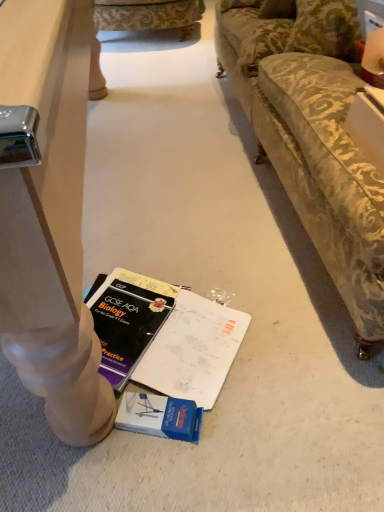
This screenshot has height=512, width=384. What do you see at coordinates (150, 16) in the screenshot?
I see `green floral fabric couch at upper center` at bounding box center [150, 16].

This screenshot has width=384, height=512. What are the coordinates of `green floral fabric couch at upper center` in the screenshot? It's located at (150, 16).

I want to click on velvet green pillow at upper right, so click(326, 29).

What do you see at coordinates (326, 29) in the screenshot? Image resolution: width=384 pixels, height=512 pixels. I see `velvet green pillow at upper right` at bounding box center [326, 29].

I want to click on green floral fabric couch at upper center, so click(150, 16).

Which object is positioned more to the left, green floral fabric couch at upper center or velvet green pillow at upper right?

Positioned to the left is green floral fabric couch at upper center.

Relative to velvet green pillow at upper right, is green floral fabric couch at upper center in front or behind?

green floral fabric couch at upper center is behind velvet green pillow at upper right.

Is point (108, 21) more distant than point (341, 37)?

Yes, it is behind point (341, 37).

From the image's perspective, between green floral fabric couch at upper center and velvet green pillow at upper right, who is located below?

velvet green pillow at upper right.

From a real-world perspective, is green floral fabric couch at upper center located higher than velvet green pillow at upper right?

No, from a real-world perspective, green floral fabric couch at upper center is not over velvet green pillow at upper right

Looking at their sizes, would you say green floral fabric couch at upper center is wider or thinner than velvet green pillow at upper right?

Clearly, green floral fabric couch at upper center has more width compared to velvet green pillow at upper right.

Considering the relative sizes of green floral fabric couch at upper center and velvet green pillow at upper right in the image provided, is green floral fabric couch at upper center shorter than velvet green pillow at upper right?

Incorrect, the height of green floral fabric couch at upper center does not fall short of that of velvet green pillow at upper right.

Who is bigger, green floral fabric couch at upper center or velvet green pillow at upper right?

With larger size is green floral fabric couch at upper center.

Looking at this image, is green floral fabric couch at upper center spatially inside velvet green pillow at upper right, or outside of it?

green floral fabric couch at upper center cannot be found inside velvet green pillow at upper right.

Is green floral fabric couch at upper center in contact with velvet green pillow at upper right?

No.

Is velvet green pillow at upper right at the back of green floral fabric couch at upper center?

No, green floral fabric couch at upper center is not facing the opposite direction of velvet green pillow at upper right.

Identify the location of studio couch behind the velvet green pillow at upper right. (150, 16).

Is velvet green pillow at upper right at the right side of green floral fabric couch at upper center?

Yes.

Which object is further away from the camera, velvet green pillow at upper right or green floral fabric couch at upper center?

green floral fabric couch at upper center is further from the camera.

Which point is more forward, (x=326, y=13) or (x=125, y=15)?

The point (x=326, y=13) is closer.

From the image's perspective, does velvet green pillow at upper right appear higher than green floral fabric couch at upper center?

No, from the image's perspective, velvet green pillow at upper right is not over green floral fabric couch at upper center.

From a real-world perspective, which is physically above, velvet green pillow at upper right or green floral fabric couch at upper center?

In real-world perspective, velvet green pillow at upper right is above.

Which of these two, velvet green pillow at upper right or green floral fabric couch at upper center, is wider?

Wider between the two is green floral fabric couch at upper center.

Is velvet green pillow at upper right taller or shorter than green floral fabric couch at upper center?

Considering their sizes, velvet green pillow at upper right has less height than green floral fabric couch at upper center.

Does velvet green pillow at upper right have a smaller size compared to green floral fabric couch at upper center?

Yes, velvet green pillow at upper right is smaller than green floral fabric couch at upper center.

Is velvet green pillow at upper right inside the boundaries of green floral fabric couch at upper center, or outside?

velvet green pillow at upper right is spatially situated outside green floral fabric couch at upper center.

Is velvet green pillow at upper right far from green floral fabric couch at upper center?

velvet green pillow at upper right is positioned a significant distance from green floral fabric couch at upper center.

From the picture: Is velvet green pillow at upper right aimed at green floral fabric couch at upper center?

No, velvet green pillow at upper right is not aimed at green floral fabric couch at upper center.

What's the angular difference between velvet green pillow at upper right and green floral fabric couch at upper center's facing directions?

velvet green pillow at upper right and green floral fabric couch at upper center are facing 7.98 degrees away from each other.

Measure the distance between velvet green pillow at upper right and green floral fabric couch at upper center.

velvet green pillow at upper right is 1.82 meters from green floral fabric couch at upper center.

At what (x,y) coordinates should I click in order to perform the action: click on pillow in front of the green floral fabric couch at upper center. Please return your answer as a coordinate pair (x, y). This screenshot has width=384, height=512. Looking at the image, I should click on tap(326, 29).

Where is `pillow above the green floral fabric couch at upper center (from a real-world perspective)`? This screenshot has height=512, width=384. pillow above the green floral fabric couch at upper center (from a real-world perspective) is located at coordinates (326, 29).

Identify the location of pillow in front of the green floral fabric couch at upper center. The image size is (384, 512). (326, 29).